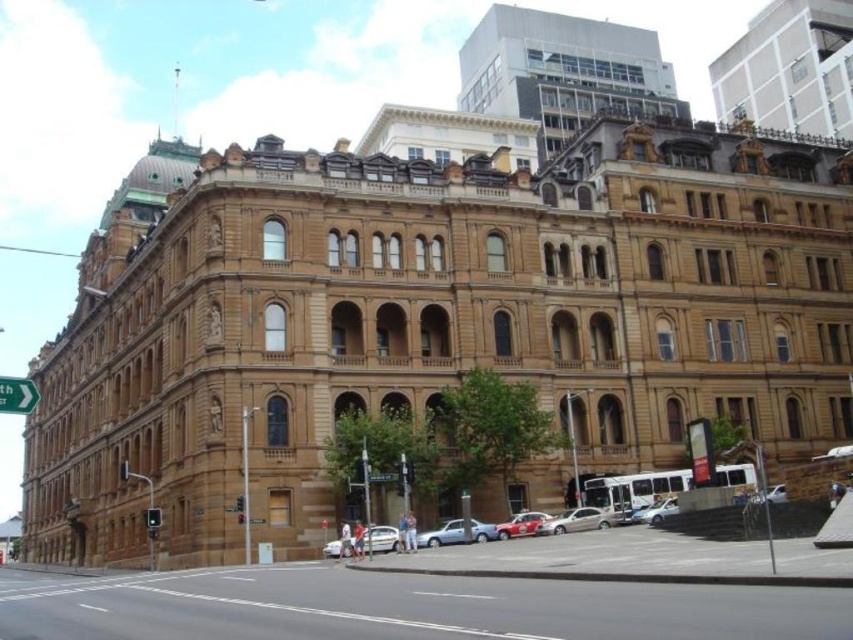
You are standing in front of the historic building and want to determine the relative positions of two points marked on the facade. Which of the two points, point 1 at coordinates point (10, 384) or point 2 at coordinates point (125, 477), is closer to you?

Point 1 at coordinates point (10, 384) is closer to the viewer than point 2 at coordinates point (125, 477).